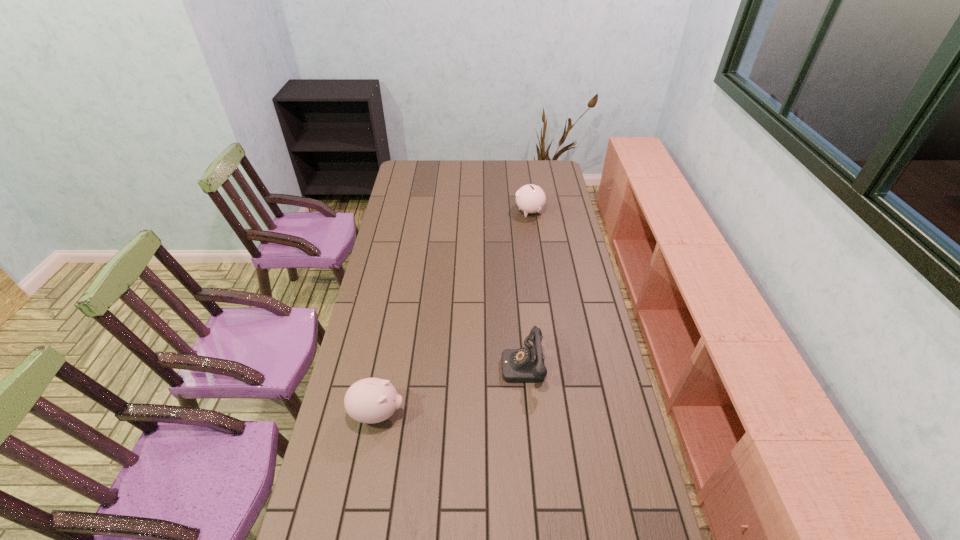
At what (x,y) coordinates should I click in order to perform the action: click on the farthest object. Please return your answer as a coordinate pair (x, y). This screenshot has width=960, height=540. Looking at the image, I should click on (530, 198).

You are a GUI agent. You are given a task and a screenshot of the screen. Output one action in this format:
    pyautogui.click(x=<x>, y=<y>)
    Task: Click on the farther piggy bank
    Image resolution: width=960 pixels, height=540 pixels.
    Given the screenshot: What is the action you would take?
    point(530,198)

Where is `the left piggy bank`? the left piggy bank is located at coordinates (371, 400).

At what (x,y) coordinates should I click in order to perform the action: click on the nearest object. Please return your answer as a coordinate pair (x, y). Looking at the image, I should click on (371, 400).

You are a GUI agent. You are given a task and a screenshot of the screen. Output one action in this format:
    pyautogui.click(x=<x>, y=<y>)
    Task: Click on the telephone
    
    Given the screenshot: What is the action you would take?
    pyautogui.click(x=524, y=365)

This screenshot has width=960, height=540. I want to click on vacant space located 0.280m on the left of the farther piggy bank, so click(459, 212).

You are a GUI agent. You are given a task and a screenshot of the screen. Output one action in this format:
    pyautogui.click(x=<x>, y=<y>)
    Task: Click on the vacant space positioned at the snout of the nearer piggy bank
    This screenshot has width=960, height=540.
    Given the screenshot: What is the action you would take?
    pyautogui.click(x=499, y=413)

In order to click on vacant area situated on the dial of the telephone in this screenshot , I will do `click(390, 364)`.

Where is `vacant area situated 0.220m on the dial of the telephone`? This screenshot has width=960, height=540. vacant area situated 0.220m on the dial of the telephone is located at coordinates (439, 364).

The height and width of the screenshot is (540, 960). I want to click on blank space located on the dial of the telephone, so click(x=424, y=364).